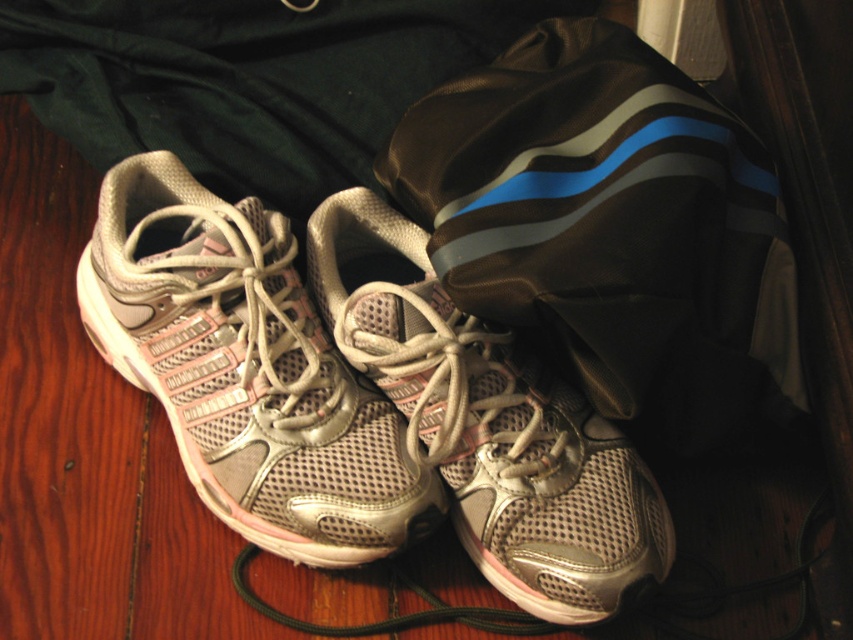
Does brown fabric bag at center lie behind silver mesh running shoe at center?

No, it is in front of silver mesh running shoe at center.

Where is `brown fabric bag at center`? The height and width of the screenshot is (640, 853). brown fabric bag at center is located at coordinates (611, 227).

Between point (560, 346) and point (177, 316), which one is positioned in front?

Point (177, 316) is more forward.

Identify the location of brown fabric bag at center. The width and height of the screenshot is (853, 640). (611, 227).

Is silver mesh running shoe at center positioned at the back of metallic mesh shoe at center?

Yes, silver mesh running shoe at center is further from the viewer.

Can you confirm if silver mesh running shoe at center is wider than metallic mesh shoe at center?

Yes.

Identify the location of silver mesh running shoe at center. The width and height of the screenshot is (853, 640). (247, 371).

Who is more forward, (x=682, y=244) or (x=625, y=588)?

Point (x=625, y=588) is in front.

The height and width of the screenshot is (640, 853). In order to click on brown fabric bag at center in this screenshot , I will do `click(611, 227)`.